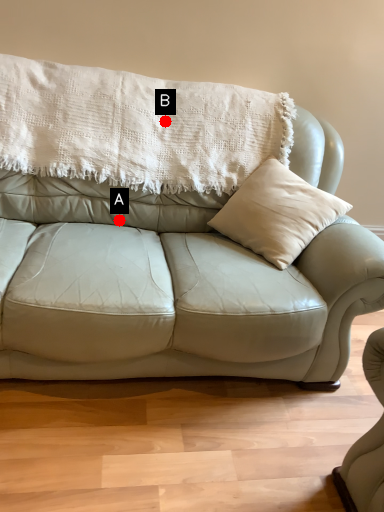
Question: Two points are circled on the image, labeled by A and B beside each circle. Which point appears farthest from the camera in this image?

Choices:
 (A) A is further
 (B) B is further

Answer: (B)